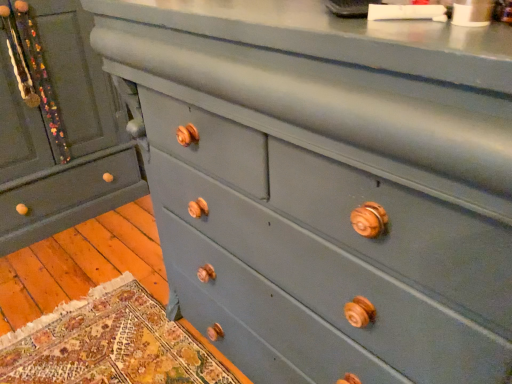
Question: Should I look upward or downward to see matte gray dresser at left?

Choices:
 (A) up
 (B) down

Answer: (A)